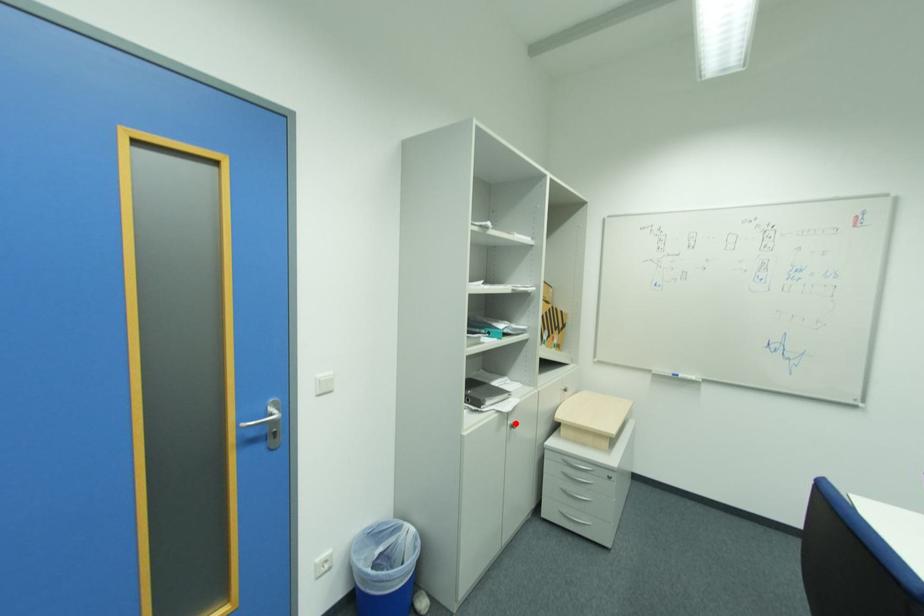
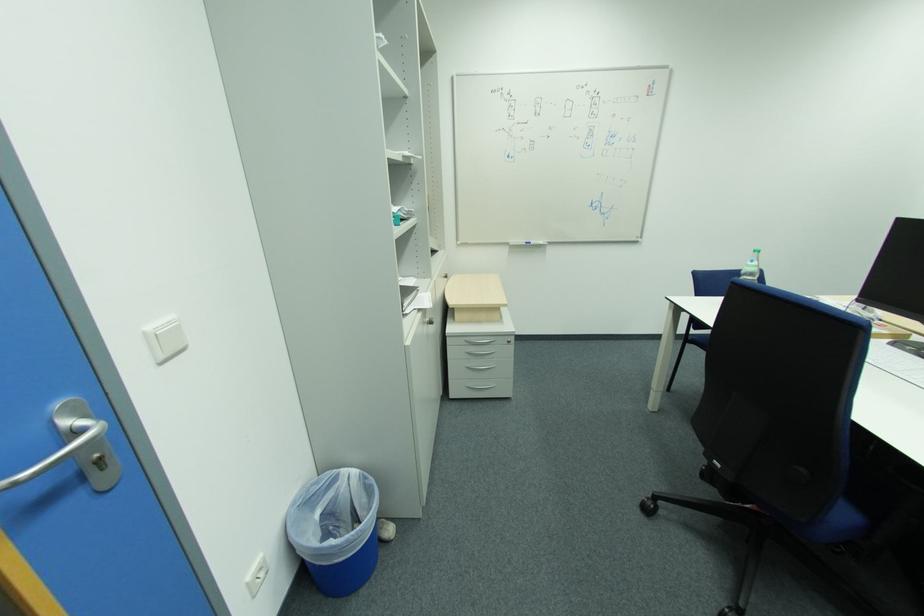
Question: I am providing you with two images of the same scene from different viewpoints. In image1, a red point is highlighted. Considering the same 3D point in image2, which of the following is correct?

Choices:
 (A) It is closer
 (B) It is farther

Answer: (A)